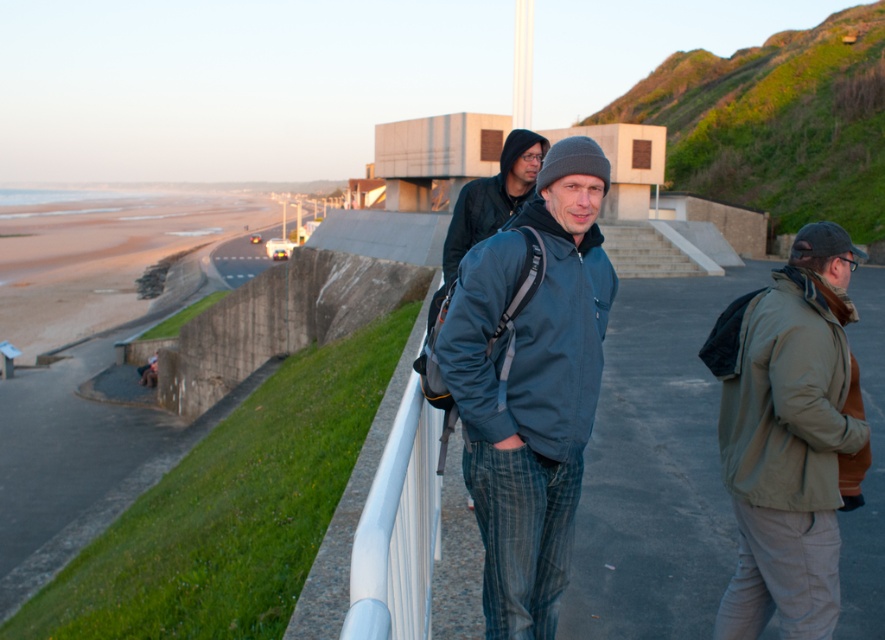
Is khaki fabric jacket at right shorter than dark blue jacket at center?

No.

From the picture: Can you confirm if khaki fabric jacket at right is thinner than dark blue jacket at center?

Yes, khaki fabric jacket at right is thinner than dark blue jacket at center.

Where is `khaki fabric jacket at right`? The width and height of the screenshot is (885, 640). khaki fabric jacket at right is located at coordinates (789, 436).

At what (x,y) coordinates should I click in order to perform the action: click on khaki fabric jacket at right. Please return your answer as a coordinate pair (x, y). Looking at the image, I should click on (789, 436).

Is the position of matte blue jacket at center more distant than that of khaki fabric jacket at right?

That is False.

Does matte blue jacket at center appear on the right side of khaki fabric jacket at right?

In fact, matte blue jacket at center is to the left of khaki fabric jacket at right.

At what (x,y) coordinates should I click in order to perform the action: click on matte blue jacket at center. Please return your answer as a coordinate pair (x, y). This screenshot has height=640, width=885. Looking at the image, I should click on (531, 387).

Can you confirm if matte blue jacket at center is thinner than dark blue jacket at center?

No.

Does matte blue jacket at center appear on the right side of dark blue jacket at center?

Yes, matte blue jacket at center is to the right of dark blue jacket at center.

Is point (552, 220) closer to camera compared to point (501, 184)?

Yes, it is.

Where is `matte blue jacket at center`? The width and height of the screenshot is (885, 640). matte blue jacket at center is located at coordinates (531, 387).